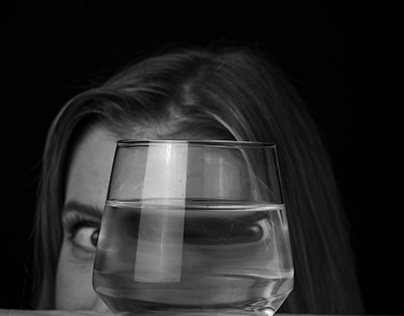
This screenshot has height=316, width=404. Find the location of `glass`. glass is located at coordinates (206, 258).